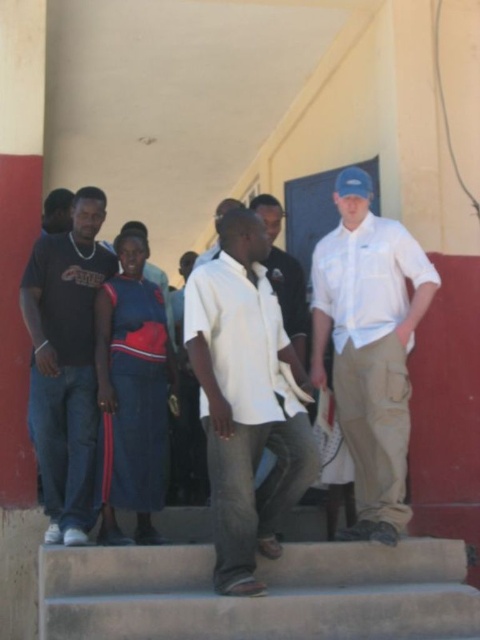
You are an observer looking at the group of people on the steps. Which clothing item, the white cotton shirt at center or the blue denim skirt at center, takes up more visual space in the scene?

The white cotton shirt at center takes up more visual space than the blue denim skirt at center because it has a larger size.

You are standing at the entrance of the building with a yellow and red facade. You need to find the concrete stairs at center. According to the coordinates provided, where exactly should you look to locate them?

The concrete stairs at center are located at the 2D coordinates point [260,596].